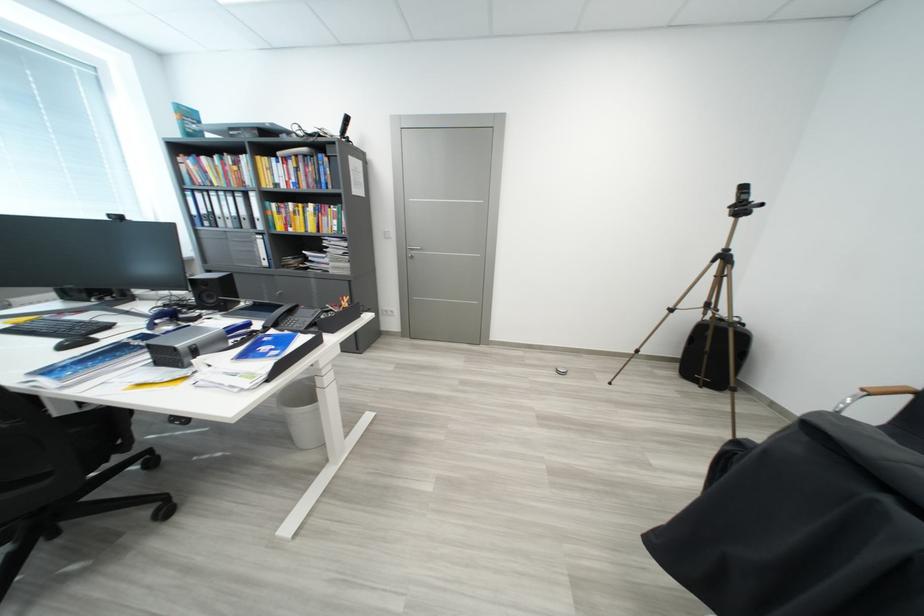
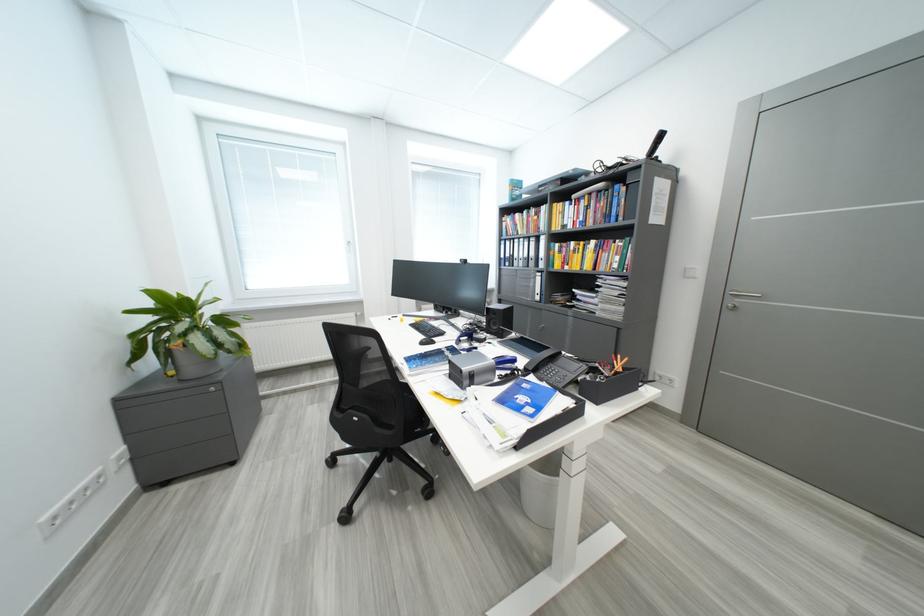
Question: I am providing you with two images of the same scene from different viewpoints. Please identify which objects are invisible in image2.

Choices:
 (A) black cabinet handle
 (B) black telephone handset
 (C) silver door handle
 (D) none of these

Answer: (D)